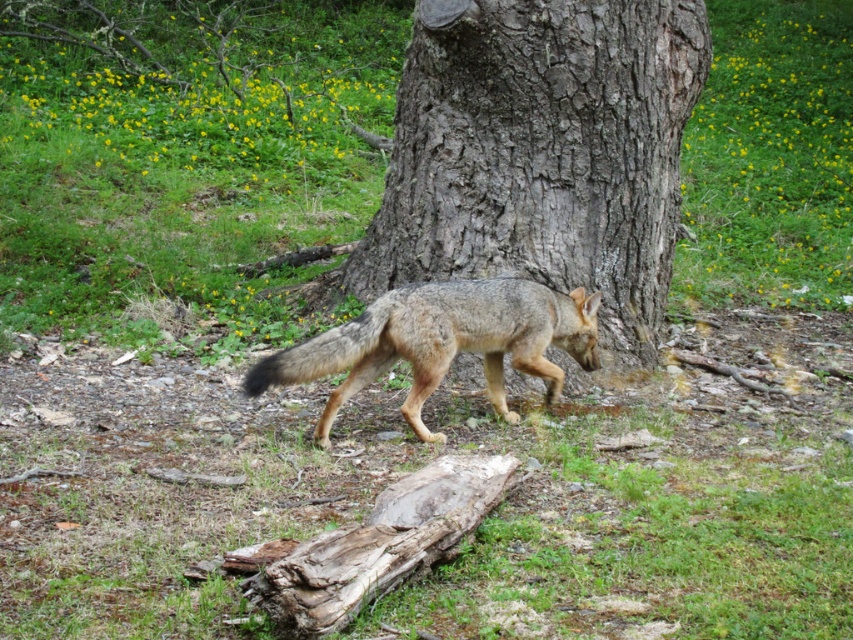
Consider the image. Does gray bark tree at center lie behind fur-like gray fox at center?

Yes.

Does point (428, 177) come in front of point (401, 301)?

No, (428, 177) is further to viewer.

Measure the distance between point (x=630, y=129) and camera.

Point (x=630, y=129) and camera are 21.00 feet apart.

Where is `gray bark tree at center`? This screenshot has width=853, height=640. gray bark tree at center is located at coordinates [x=538, y=156].